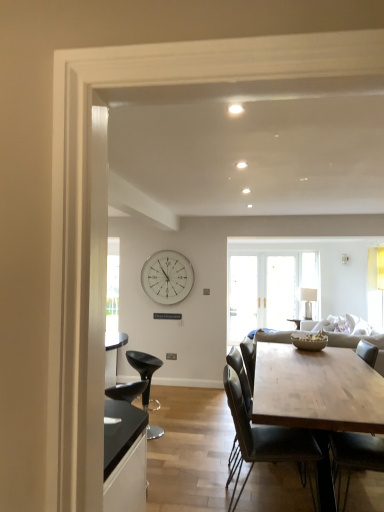
Question: Would you say dark gray leather chair at center, the second chair viewed from the right, is inside or outside white glossy clock at upper center?

Choices:
 (A) outside
 (B) inside

Answer: (A)

Question: Considering the positions of point (254, 424) and point (147, 293), is point (254, 424) closer or farther from the camera than point (147, 293)?

Choices:
 (A) farther
 (B) closer

Answer: (B)

Question: Estimate the real-world distances between objects in this image. Which object is closer to the light gray fabric couch at center?

Choices:
 (A) dark gray leather chair at center, which ranks as the 2th chair in back-to-front order
 (B) wooden chair at center, the third chair in the back-to-front sequence
 (C) white glossy clock at upper center
 (D) natural wood table at center
 (E) black plastic stool at lower left, marked as the 3th chair in a right-to-left arrangement

Answer: (D)

Question: Estimate the real-world distances between objects in this image. Which object is farther from the wooden chair at center, which is the 3th chair from left to right?

Choices:
 (A) white glossy clock at upper center
 (B) natural wood table at center
 (C) light gray fabric couch at center
 (D) black plastic stool at lower left, the first chair in the back-to-front sequence
 (E) dark gray leather chair at center, the 2th chair when ordered from front to back

Answer: (A)